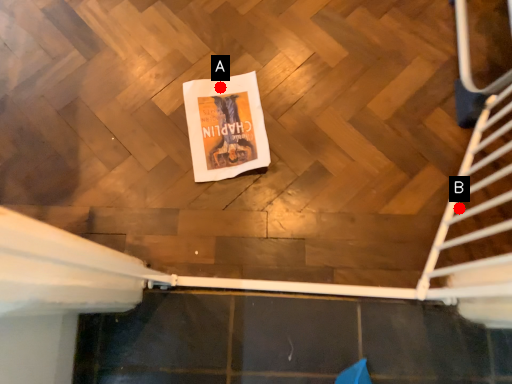
Question: Two points are circled on the image, labeled by A and B beside each circle. Which of the following is the closest to the observer?

Choices:
 (A) A is closer
 (B) B is closer

Answer: (B)